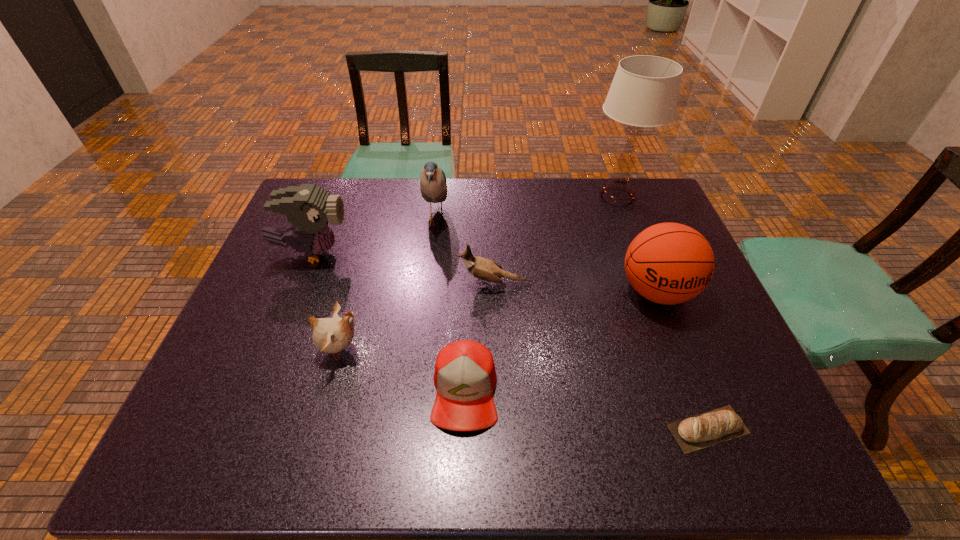
Where is `free area in between the third nearest bird and the rightmost bird`? The image size is (960, 540). free area in between the third nearest bird and the rightmost bird is located at coordinates [x=403, y=268].

Locate an element on the screen. The height and width of the screenshot is (540, 960). vacant space that is in between the shortest object and the third farthest bird is located at coordinates (601, 356).

This screenshot has height=540, width=960. I want to click on vacant region between the third farthest object and the nearest bird, so click(x=326, y=301).

Where is `vacant space that's between the second bird from right to left and the basketball`? vacant space that's between the second bird from right to left and the basketball is located at coordinates (546, 256).

This screenshot has height=540, width=960. What are the coordinates of `unoccupied area between the farthest bird and the shortest object` in the screenshot? It's located at (572, 325).

Locate an element on the screen. This screenshot has height=540, width=960. the sixth closest object relative to the seventh tallest object is located at coordinates point(433,186).

Locate an element on the screen. This screenshot has width=960, height=540. object that can be found as the closest to the nearest bird is located at coordinates (465, 377).

Identify which bird is the closest to the farthest bird. Please provide its 2D coordinates. Your answer should be formatted as a tuple, i.e. [(x, y)], where the tuple contains the x and y coordinates of a point satisfying the conditions above.

[(485, 269)]

Locate which bird is the third closest to the rightmost bird. Please provide its 2D coordinates. Your answer should be formatted as a tuple, i.e. [(x, y)], where the tuple contains the x and y coordinates of a point satisfying the conditions above.

[(309, 208)]

Find the location of a particular element. vacant area in the image that satisfies the following two spatial constraints: 1. at the face of the rightmost bird; 2. on the front-facing side of the baseball cap is located at coordinates (498, 391).